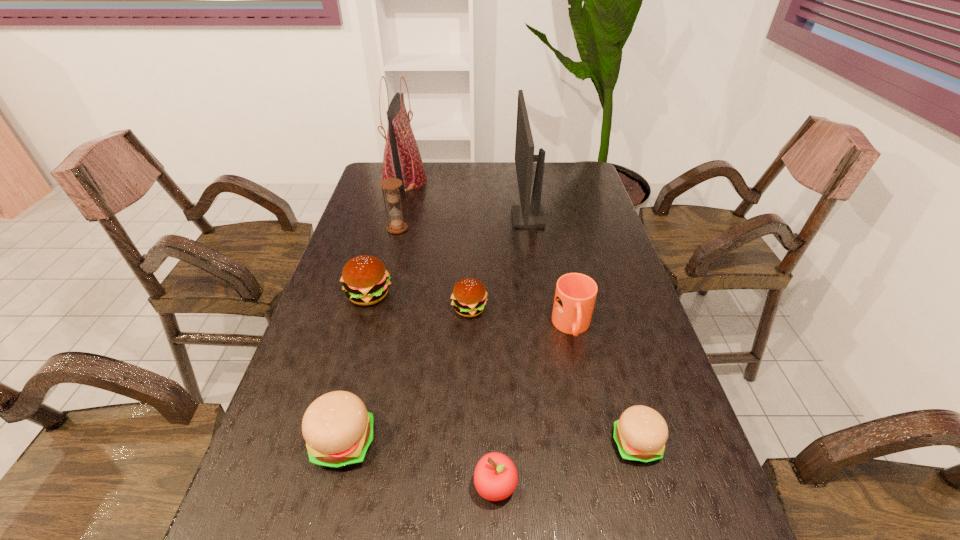
You are a GUI agent. You are given a task and a screenshot of the screen. Output one action in this format:
    pyautogui.click(x=<x>, y=<y>)
    Task: Click on the rightmost hamburger
    Image resolution: width=960 pixels, height=540 pixels.
    Given the screenshot: What is the action you would take?
    [x=640, y=434]

What are the coordinates of `the smaller beige hamburger` in the screenshot? It's located at (640, 434).

Identify the location of blank area located 0.320m on the right of the handbag. (509, 180).

The image size is (960, 540). In order to click on vacant area situated 0.280m on the front-facing side of the computer monitor in this screenshot , I will do `click(431, 218)`.

I want to click on free spot located 0.350m on the front-facing side of the computer monitor, so click(x=411, y=218).

Locate an element on the screen. The image size is (960, 540). free spot located 0.150m on the front-facing side of the computer monitor is located at coordinates (468, 218).

Locate an element on the screen. The width and height of the screenshot is (960, 540). free point located on the front of the brown hourglass is located at coordinates (388, 266).

Find the location of a particular element. vacant space located 0.320m on the handle side of the mug is located at coordinates (604, 478).

Identify the location of vacant area situated on the right of the bigger brown hamburger. This screenshot has height=540, width=960. (446, 295).

Locate an element on the screen. This screenshot has width=960, height=540. vacant space located on the right of the left beige hamburger is located at coordinates point(533,443).